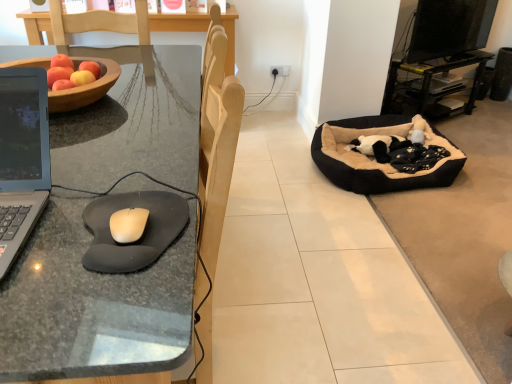
The image size is (512, 384). I want to click on vacant space situated on the left part of white matte mouse at left, so click(53, 228).